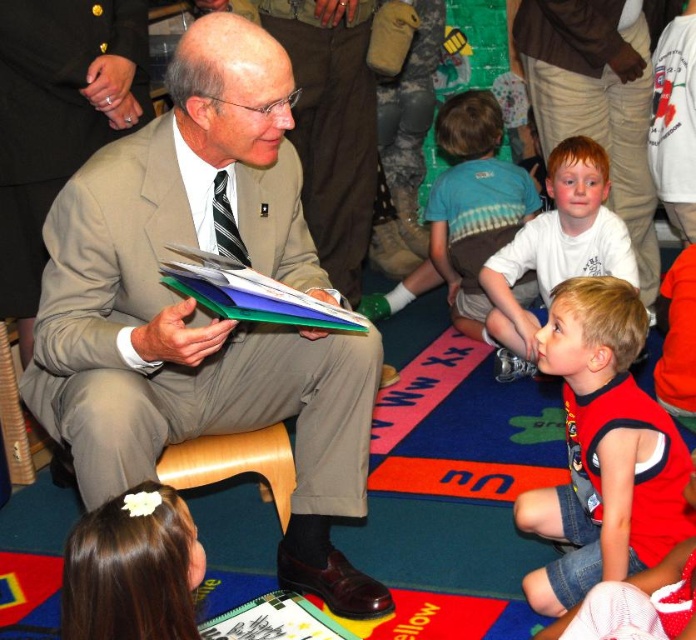
Question: Considering the real-world distances, which object is farthest from the beige fabric suit at upper left?

Choices:
 (A) red cotton shirt at lower right
 (B) matte beige suit at center
 (C) blue striped shirt at center
 (D) multicolored paper stack at center

Answer: (A)

Question: Does beige fabric suit at upper left appear on the right side of white matte shirt at center?

Choices:
 (A) no
 (B) yes

Answer: (A)

Question: Which of the following is the farthest from the observer?

Choices:
 (A) blue striped shirt at center
 (B) beige fabric suit at upper left

Answer: (A)

Question: Is red cotton shirt at lower right thinner than multicolored paper stack at center?

Choices:
 (A) yes
 (B) no

Answer: (A)

Question: Considering the real-world distances, which object is closest to the red cotton shirt at lower right?

Choices:
 (A) white matte shirt at center
 (B) multicolored paper stack at center

Answer: (B)

Question: From the image, what is the correct spatial relationship of beige fabric suit at upper left in relation to white matte shirt at center?

Choices:
 (A) left
 (B) right

Answer: (A)